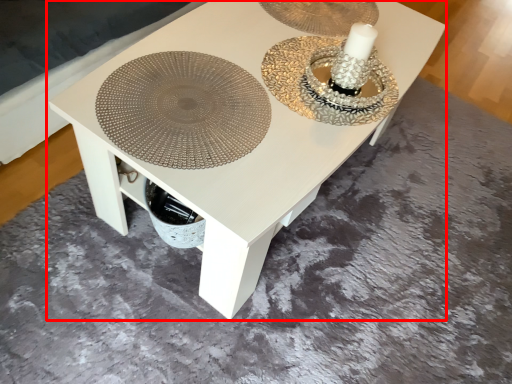
Question: From the image's perspective, where is table (annotated by the red box) located in relation to platter in the image?

Choices:
 (A) above
 (B) below

Answer: (A)